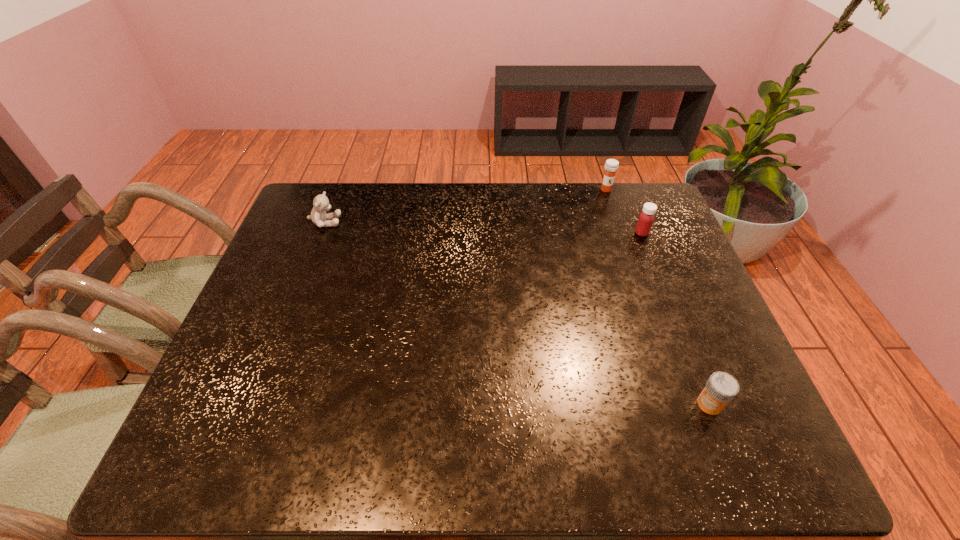
The width and height of the screenshot is (960, 540). I want to click on vacant space located 0.140m on the label side of the nearest object, so click(632, 404).

Locate an element on the screen. This screenshot has width=960, height=540. vacant space located on the label side of the nearest object is located at coordinates (558, 404).

Identify the location of medicine located at the far edge. This screenshot has width=960, height=540. (611, 166).

Locate an element on the screen. teddy bear that is at the far edge is located at coordinates (321, 204).

Locate an element on the screen. object present at the left edge is located at coordinates (321, 204).

Where is `object that is at the far left corner`? The height and width of the screenshot is (540, 960). object that is at the far left corner is located at coordinates (321, 204).

You are a GUI agent. You are given a task and a screenshot of the screen. Output one action in this format:
    pyautogui.click(x=<x>, y=<y>)
    Task: Click on the object at the far right corner
    The image size is (960, 540).
    Given the screenshot: What is the action you would take?
    pyautogui.click(x=611, y=166)

This screenshot has width=960, height=540. Identify the location of vacant area at the far edge of the desktop. tap(569, 200).

Find the location of `free space at the near edge of the desktop`. free space at the near edge of the desktop is located at coordinates (382, 433).

Where is `vacant region at the left edge of the desktop`? Image resolution: width=960 pixels, height=540 pixels. vacant region at the left edge of the desktop is located at coordinates (295, 246).